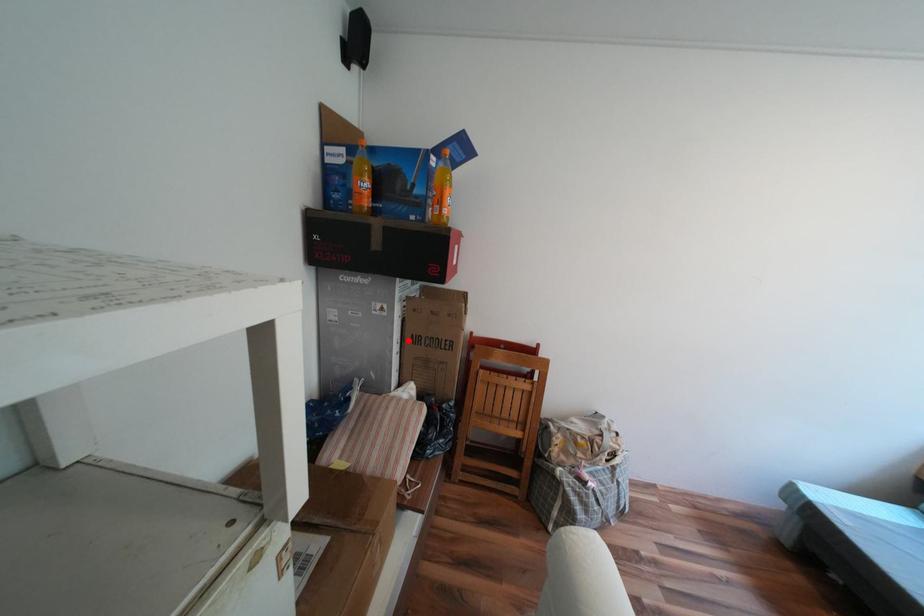
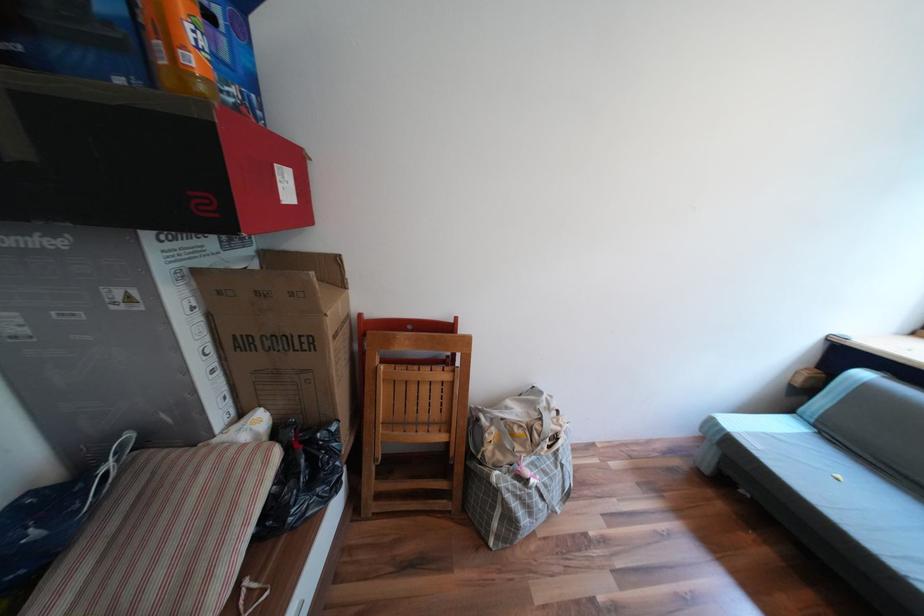
Find the pixel in the second image that matches the highlighted location in the first image.

(219, 349)